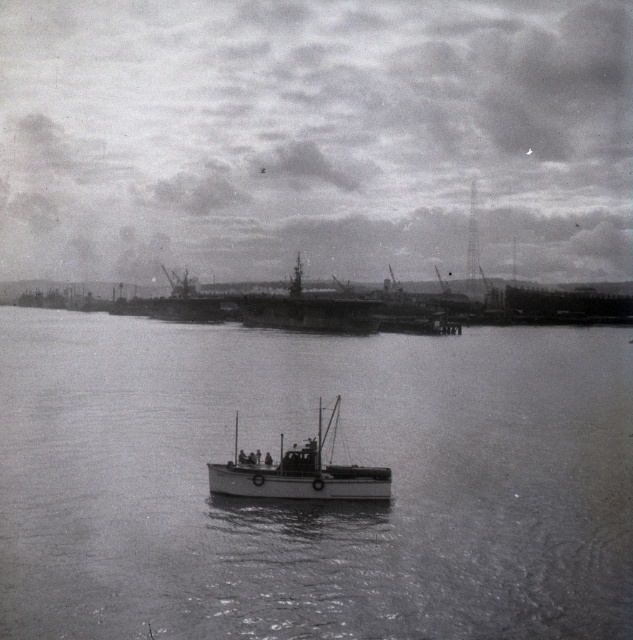
Is smooth water at center further to camera compared to smooth metal ship at center?

That is False.

Does smooth water at center come in front of smooth metal ship at center?

Yes, it is.

Does point (501, 522) come farther from viewer compared to point (348, 317)?

No, it is in front of (348, 317).

Find the location of `smooth water at center`. smooth water at center is located at coordinates (311, 502).

How distant is smooth white boat at center from smooth metal ship at center?

A distance of 316.24 feet exists between smooth white boat at center and smooth metal ship at center.

Is smooth white boat at center taller than smooth metal ship at center?

No, smooth white boat at center is not taller than smooth metal ship at center.

The image size is (633, 640). What do you see at coordinates (301, 472) in the screenshot?
I see `smooth white boat at center` at bounding box center [301, 472].

I want to click on smooth white boat at center, so click(x=301, y=472).

Does smooth water at center have a greater width compared to smooth white boat at center?

Yes, smooth water at center is wider than smooth white boat at center.

Looking at this image, which is more to the right, smooth water at center or smooth white boat at center?

smooth white boat at center is more to the right.

Does point (78, 572) lie behind point (303, 467)?

No.

Locate an element on the screen. Image resolution: width=633 pixels, height=640 pixels. smooth water at center is located at coordinates (311, 502).